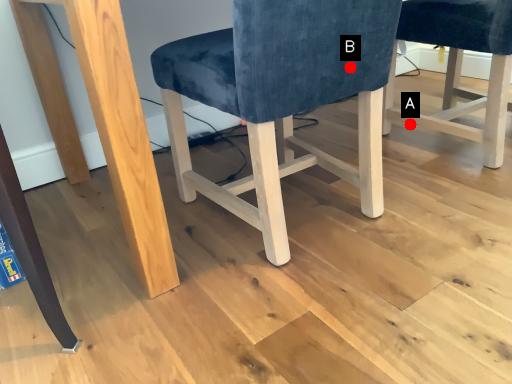
Question: Two points are circled on the image, labeled by A and B beside each circle. Which point is farther from the camera taking this photo?

Choices:
 (A) A is further
 (B) B is further

Answer: (A)